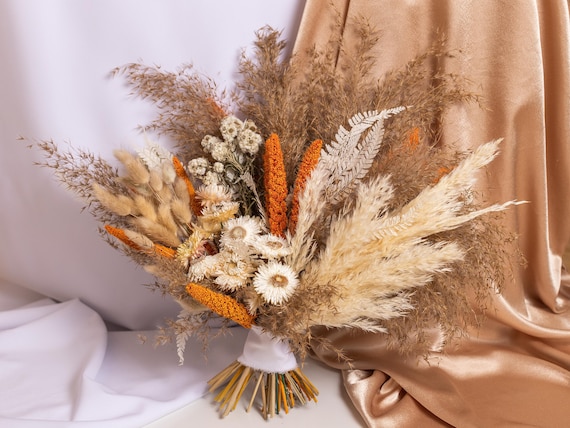
Where is `wrinkle in gold fabric`? Image resolution: width=570 pixels, height=428 pixels. wrinkle in gold fabric is located at coordinates (380, 388).